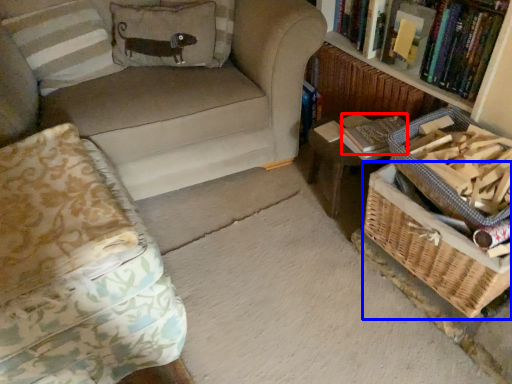
Question: Which point is closer to the camera, paperback book (highlighted by a red box) or basket (highlighted by a blue box)?

Choices:
 (A) paperback book
 (B) basket

Answer: (B)